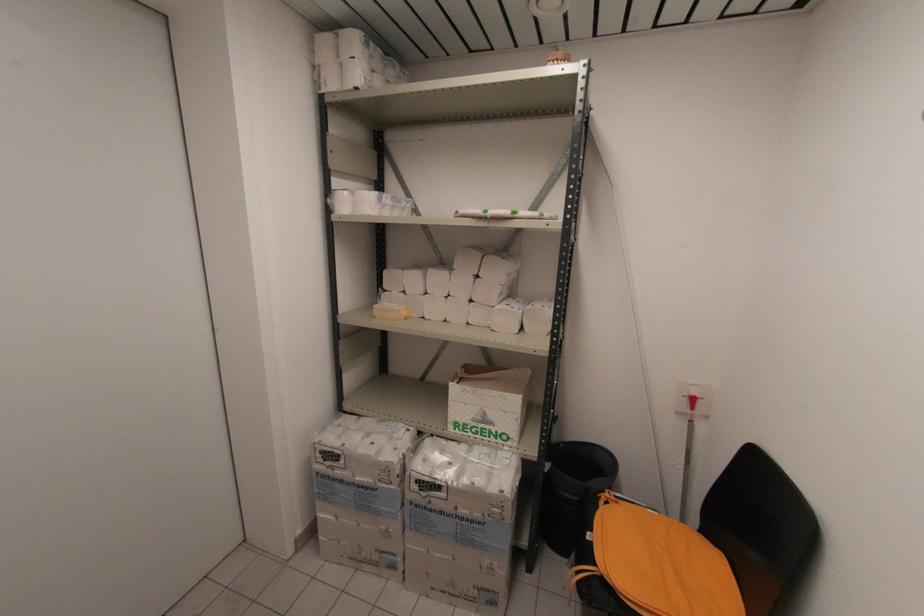
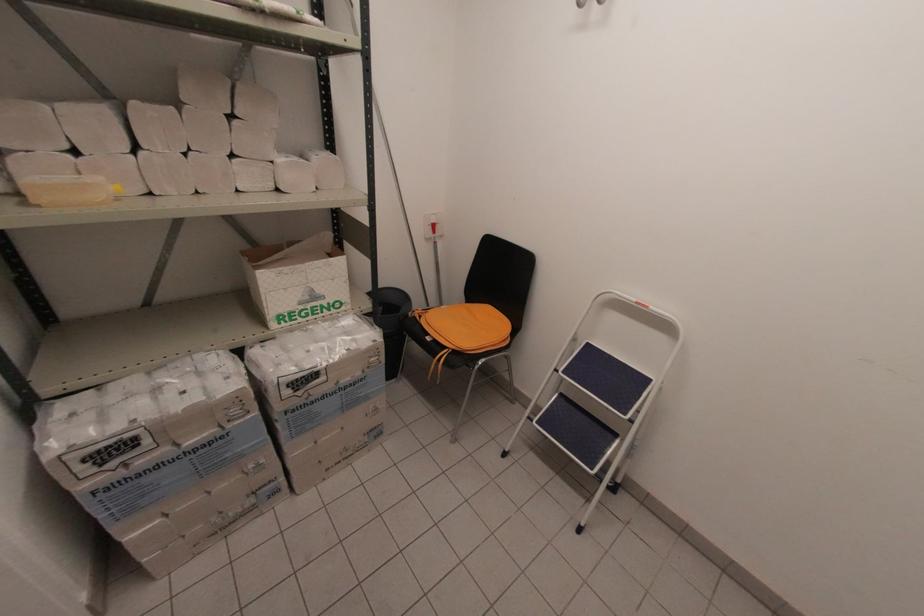
Where in the second image is the point corresponding to point 432,512 from the first image?

(312, 403)